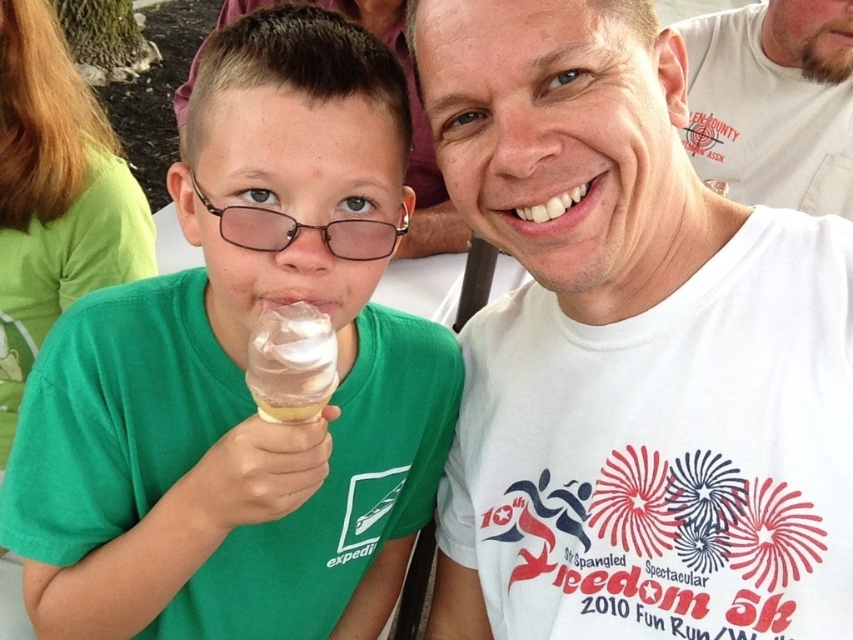
Question: Can you confirm if white creamy ice cream at center is bigger than clear plastic glasses at center?

Choices:
 (A) yes
 (B) no

Answer: (B)

Question: Can you confirm if green matte shirt at center is thinner than white creamy ice cream at center?

Choices:
 (A) yes
 (B) no

Answer: (B)

Question: Is white cotton t-shirt at upper right above clear plastic glasses at center?

Choices:
 (A) yes
 (B) no

Answer: (A)

Question: Among these objects, which one is farthest from the camera?

Choices:
 (A) clear plastic glasses at center
 (B) green matte shirt at center

Answer: (A)

Question: Which object appears farthest from the camera in this image?

Choices:
 (A) white creamy ice cream at center
 (B) white cotton t-shirt at center
 (C) clear plastic glasses at center
 (D) green matte shirt at center

Answer: (C)

Question: Estimate the real-world distances between objects in this image. Which object is closer to the white creamy ice cream at center?

Choices:
 (A) clear plastic glasses at center
 (B) white cotton t-shirt at upper right
 (C) green matte shirt at center

Answer: (A)